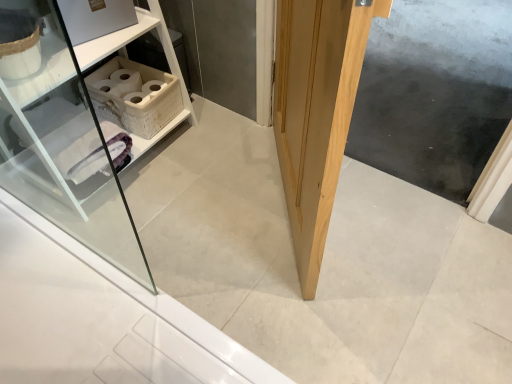
Question: Is white wicker basket at upper left placed right next to natural wood door at center?

Choices:
 (A) yes
 (B) no

Answer: (B)

Question: Is white wicker basket at upper left turned away from natural wood door at center?

Choices:
 (A) yes
 (B) no

Answer: (B)

Question: Is white wicker basket at upper left smaller than natural wood door at center?

Choices:
 (A) no
 (B) yes

Answer: (B)

Question: Does white wicker basket at upper left come in front of natural wood door at center?

Choices:
 (A) yes
 (B) no

Answer: (B)

Question: Would you consider white wicker basket at upper left to be distant from natural wood door at center?

Choices:
 (A) yes
 (B) no

Answer: (B)

Question: Is white wicker basket at upper left outside natural wood door at center?

Choices:
 (A) yes
 (B) no

Answer: (A)

Question: From a real-world perspective, is white wicker basket at upper left under natural wood screen door at center?

Choices:
 (A) no
 (B) yes

Answer: (A)

Question: Is white wicker basket at upper left shorter than natural wood screen door at center?

Choices:
 (A) yes
 (B) no

Answer: (B)

Question: Could you tell me if white wicker basket at upper left is turned towards natural wood screen door at center?

Choices:
 (A) no
 (B) yes

Answer: (A)

Question: Is white wicker basket at upper left not within natural wood screen door at center?

Choices:
 (A) no
 (B) yes

Answer: (B)

Question: Is the depth of white wicker basket at upper left greater than that of natural wood screen door at center?

Choices:
 (A) yes
 (B) no

Answer: (B)

Question: From the image's perspective, does white wicker basket at upper left appear higher than natural wood screen door at center?

Choices:
 (A) yes
 (B) no

Answer: (B)

Question: Is white wicker shelf at upper left next to natural wood door at center and touching it?

Choices:
 (A) yes
 (B) no

Answer: (B)